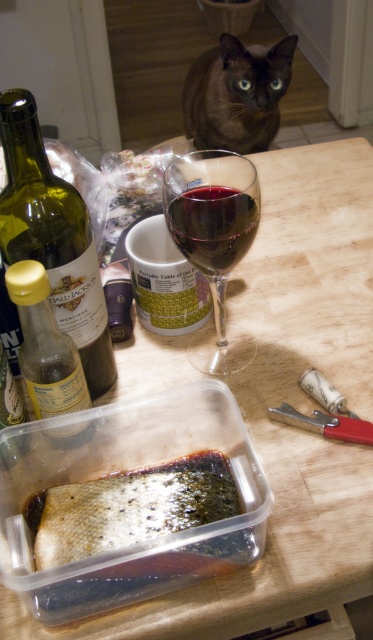
Does transparent glass wine glass at center come behind ruby glass wine at center?

No, transparent glass wine glass at center is in front of ruby glass wine at center.

Which is in front, point (243, 339) or point (199, 208)?

Point (199, 208) is in front.

This screenshot has width=373, height=640. I want to click on transparent glass wine glass at center, so click(x=214, y=241).

Which is more to the right, transparent glass wine glass at center or brown fur cat at upper center?

Positioned to the right is brown fur cat at upper center.

Does point (189, 195) come in front of point (204, 97)?

Yes, point (189, 195) is closer to viewer.

Locate an element on the screen. The width and height of the screenshot is (373, 640). transparent glass wine glass at center is located at coordinates (214, 241).

Image resolution: width=373 pixels, height=640 pixels. In order to click on transparent glass wine glass at center in this screenshot , I will do `click(214, 241)`.

Is point (212, 90) farther from camera compared to point (70, 355)?

Yes, point (212, 90) is farther from viewer.

Which is in front, point (226, 100) or point (23, 275)?

Point (23, 275) is in front.

Who is more distant from viewer, (x=182, y=92) or (x=13, y=284)?

The point (x=182, y=92) is behind.

I want to click on brown fur cat at upper center, so click(x=236, y=93).